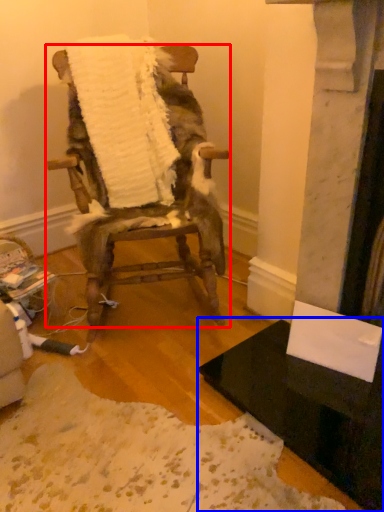
Question: Which object appears farthest to the camera in this image, chair (highlighted by a red box) or table (highlighted by a blue box)?

Choices:
 (A) chair
 (B) table

Answer: (A)